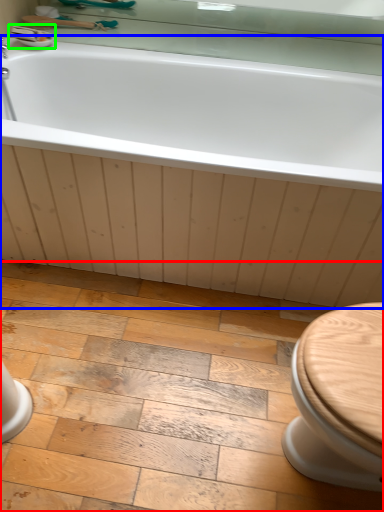
Question: Which object is positioned farthest from ceramic tile (highlighted by a red box)? Select from bathtub (highlighted by a blue box) and sink (highlighted by a green box).

Choices:
 (A) bathtub
 (B) sink

Answer: (B)